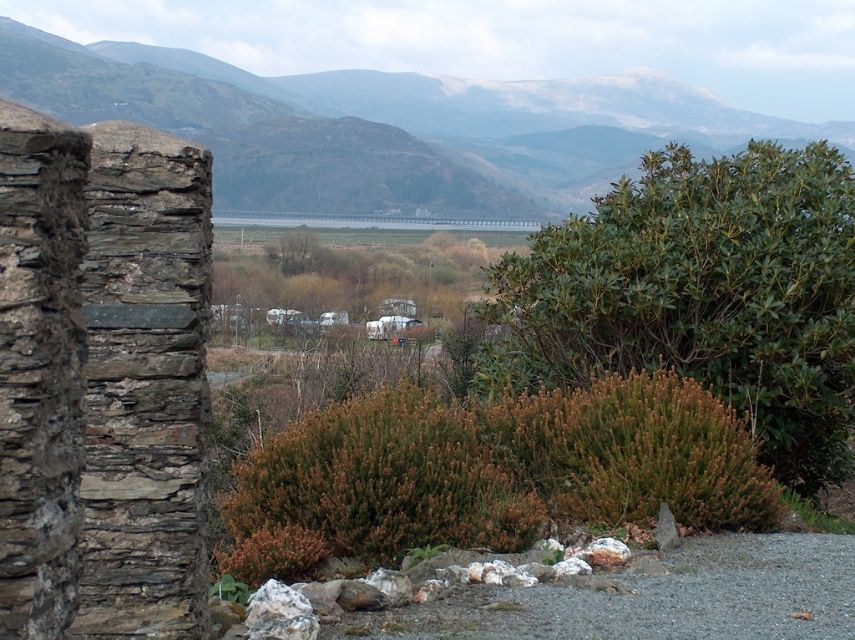
Question: Does green leafy bush at upper right lie in front of brown fuzzy bush at center?

Choices:
 (A) yes
 (B) no

Answer: (B)

Question: Among these objects, which one is nearest to the camera?

Choices:
 (A) green leafy bush at upper right
 (B) green grassy mountain at upper center

Answer: (A)

Question: Which object is closer to the camera taking this photo?

Choices:
 (A) brown fuzzy bush at center
 (B) green leafy bush at upper right
 (C) green grassy mountain at upper center

Answer: (A)

Question: Which point is closer to the camera taking this photo?

Choices:
 (A) (830, 269)
 (B) (375, 544)
 (C) (376, 131)

Answer: (B)

Question: Where is green leafy bush at upper right located in relation to brown fuzzy bush at center in the image?

Choices:
 (A) left
 (B) right

Answer: (B)

Question: Can you confirm if green leafy bush at upper right is positioned to the left of green grassy mountain at upper center?

Choices:
 (A) no
 (B) yes

Answer: (A)